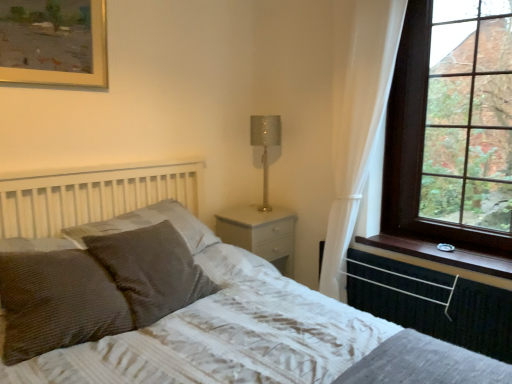
The width and height of the screenshot is (512, 384). In order to click on free space above black rubber radiator at lower right (from a real-world perspective) in this screenshot , I will do `click(416, 256)`.